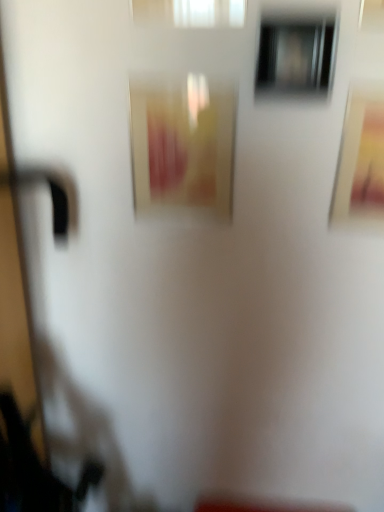
Question: Visually, is transparent glass window at upper center, the 1th window in the right-to-left sequence, positioned to the left or to the right of white translucent curtain at upper center, the 1th window when ordered from left to right?

Choices:
 (A) left
 (B) right

Answer: (B)

Question: From the image's perspective, is transparent glass window at upper center, marked as the second window in a top-to-bottom arrangement, positioned above or below white translucent curtain at upper center, which ranks as the second window in right-to-left order?

Choices:
 (A) above
 (B) below

Answer: (B)

Question: Which object is positioned closest to the matte yellow picture frame at center, placed as the second picture frame when sorted from right to left?

Choices:
 (A) matte gold picture frame at upper right, which is the 1th picture frame from right to left
 (B) transparent glass window at upper center, marked as the second window in a top-to-bottom arrangement
 (C) white translucent curtain at upper center, the 1th window when ordered from left to right

Answer: (B)

Question: Based on their relative distances, which object is farther from the matte yellow picture frame at center, the 1th picture frame positioned from the left?

Choices:
 (A) matte gold picture frame at upper right, placed as the second picture frame when sorted from left to right
 (B) white translucent curtain at upper center, acting as the 2th window starting from the bottom
 (C) transparent glass window at upper center, which appears as the 1th window when ordered from the bottom

Answer: (A)